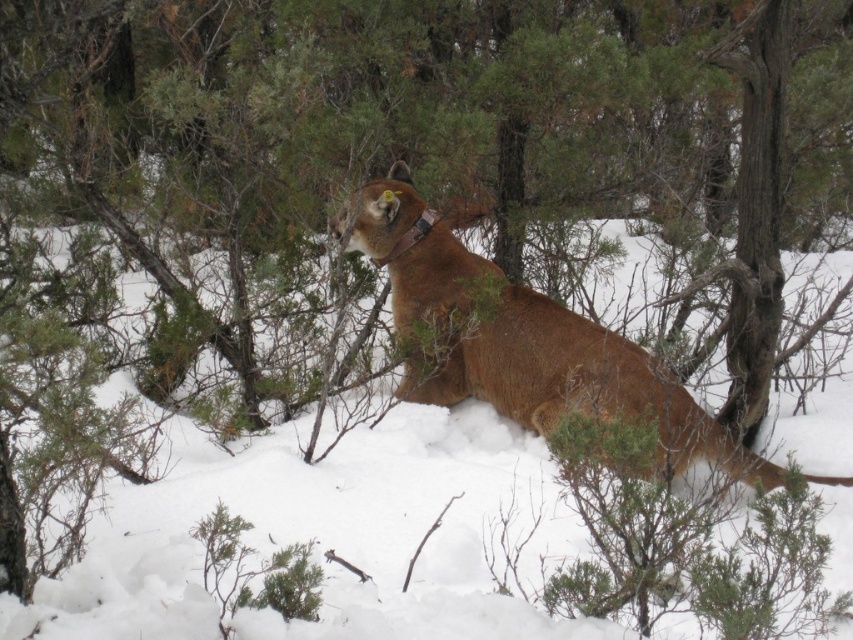
Question: Is green leafy tree at center bigger than brown fur at center?

Choices:
 (A) no
 (B) yes

Answer: (B)

Question: Which object appears closest to the camera in this image?

Choices:
 (A) green leafy tree at center
 (B) brown fur at center

Answer: (B)

Question: Does green leafy tree at center have a greater width compared to brown fur at center?

Choices:
 (A) yes
 (B) no

Answer: (A)

Question: Is the position of green leafy tree at center less distant than that of brown fur at center?

Choices:
 (A) no
 (B) yes

Answer: (A)